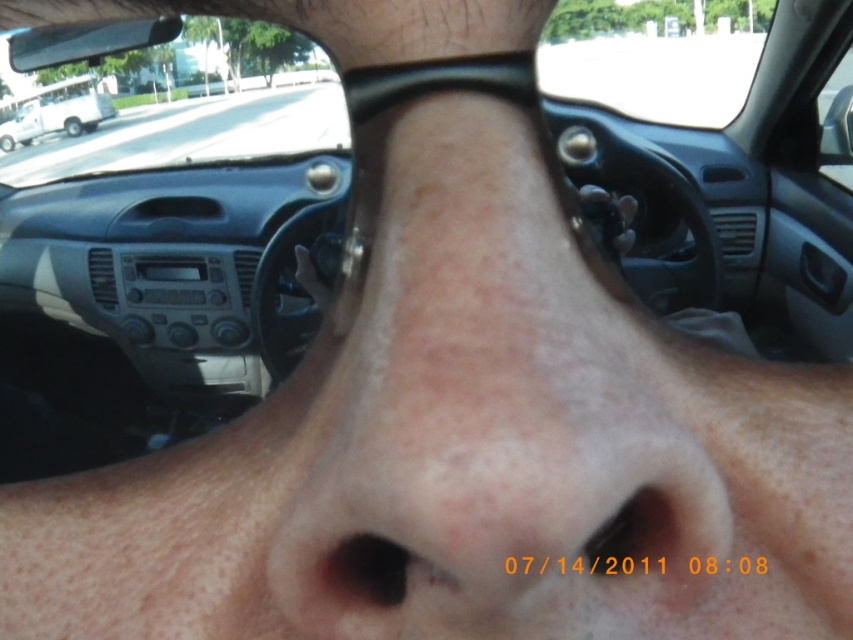
Does transparent glass car window at upper center have a greater width compared to white matte van at upper left?

Correct, the width of transparent glass car window at upper center exceeds that of white matte van at upper left.

Describe the element at coordinates (196, 129) in the screenshot. I see `transparent glass car window at upper center` at that location.

Find the location of a particular element. This screenshot has height=640, width=853. transparent glass car window at upper center is located at coordinates (196, 129).